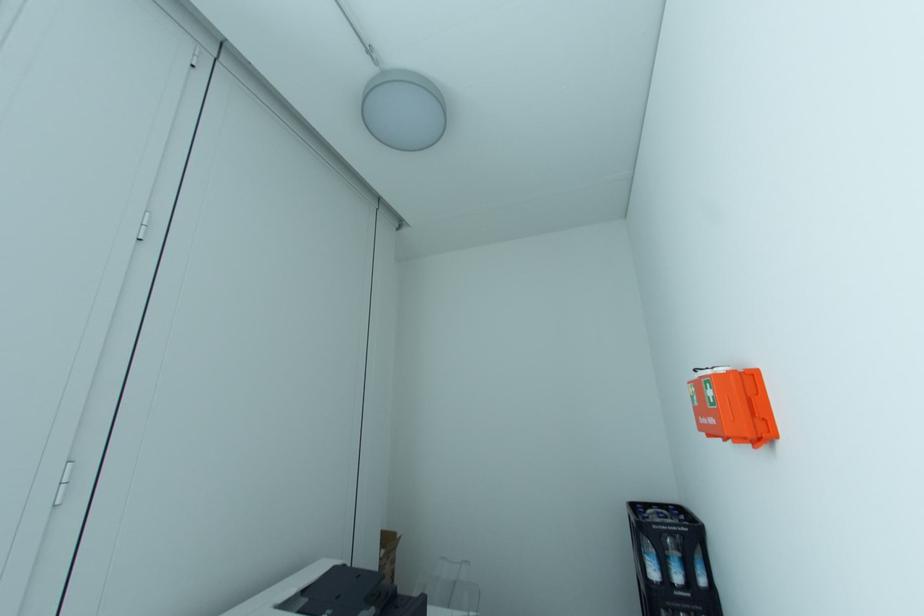
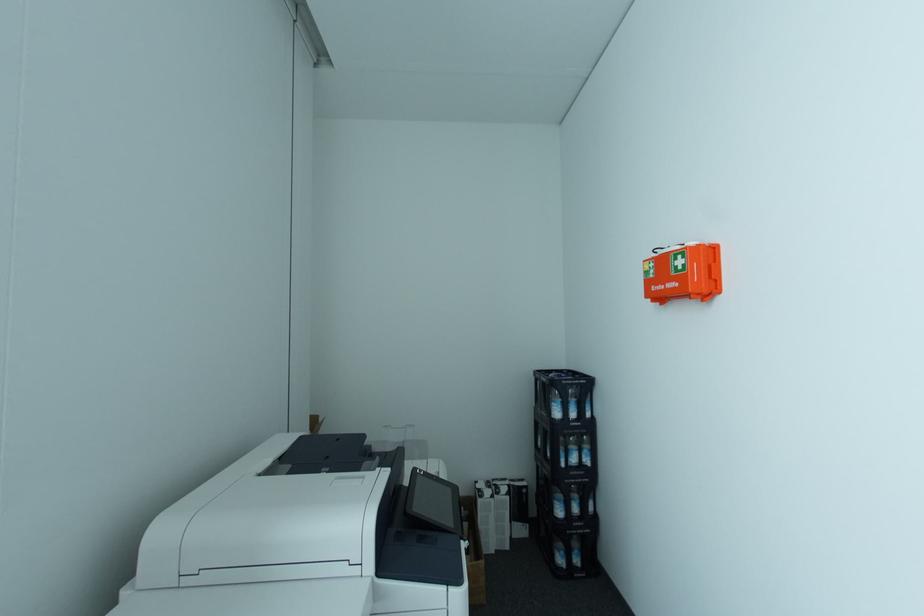
Question: The camera is either moving clockwise (left) or counter-clockwise (right) around the object. The first image is from the beginning of the video and the second image is from the end. Is the camera moving left or right when shooting the video?

Choices:
 (A) Left
 (B) Right

Answer: (A)